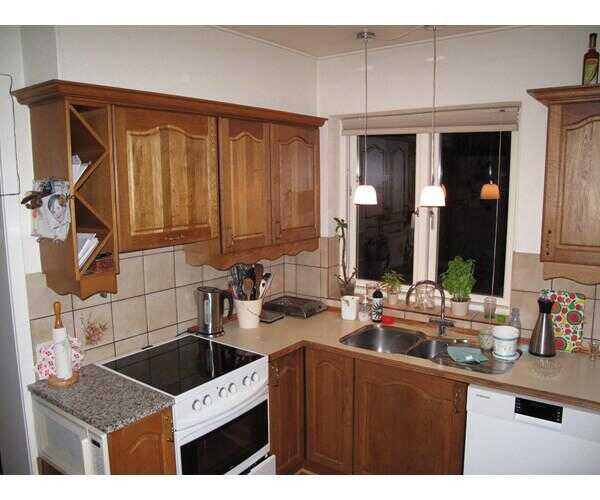
Where is `white walls`? The height and width of the screenshot is (500, 600). white walls is located at coordinates (542, 67).